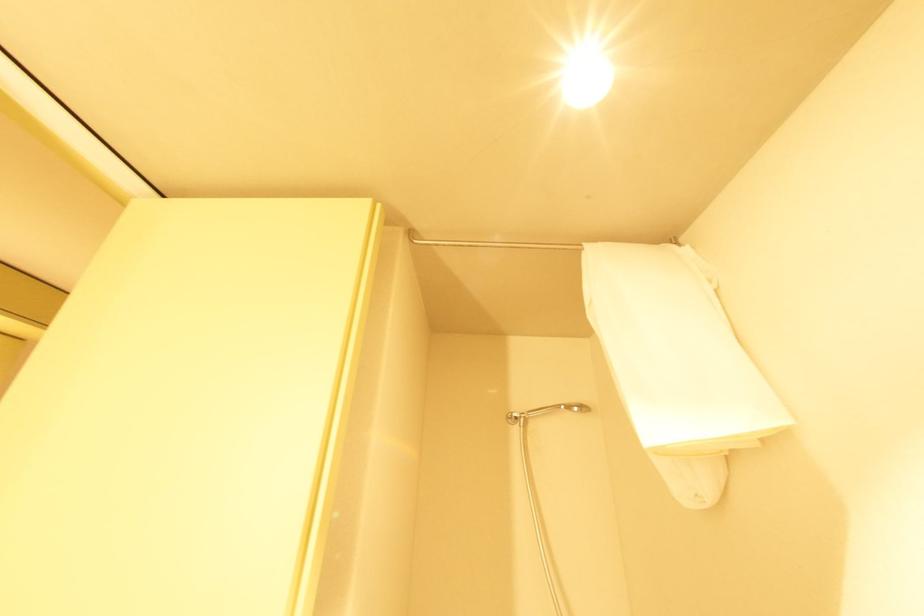
At what (x,y) coordinates should I click in order to perform the action: click on silver shower head. Please return your answer as a coordinate pair (x, y). The width and height of the screenshot is (924, 616). Looking at the image, I should click on (544, 411).